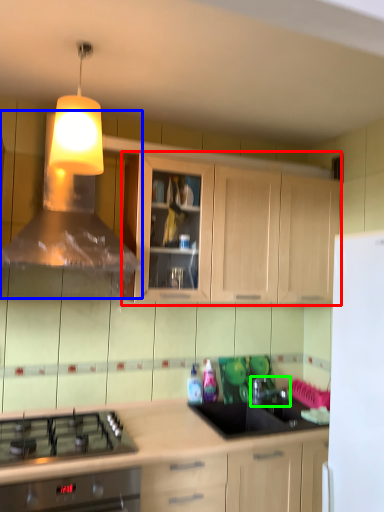
Question: Which object is the closest to the cabinetry (highlighted by a red box)? Choose among these: vent (highlighted by a blue box) or tap (highlighted by a green box).

Choices:
 (A) vent
 (B) tap

Answer: (A)